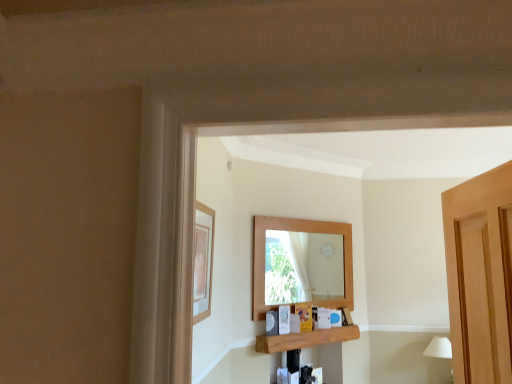
I want to click on vacant area on top of wooden shelf at center (from a real-world perspective), so click(x=311, y=328).